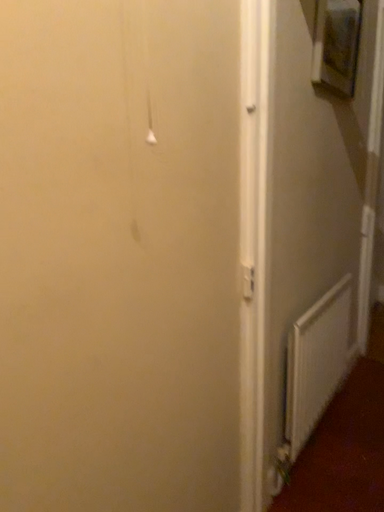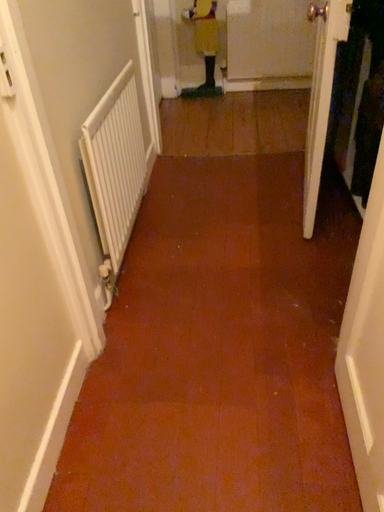
Question: How did the camera likely rotate when shooting the video?

Choices:
 (A) rotated right
 (B) rotated left

Answer: (A)